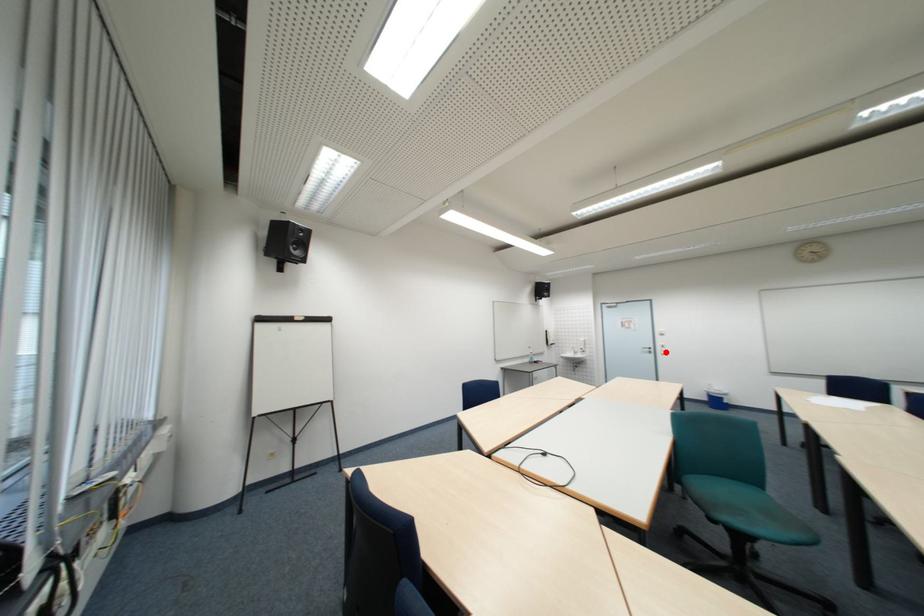
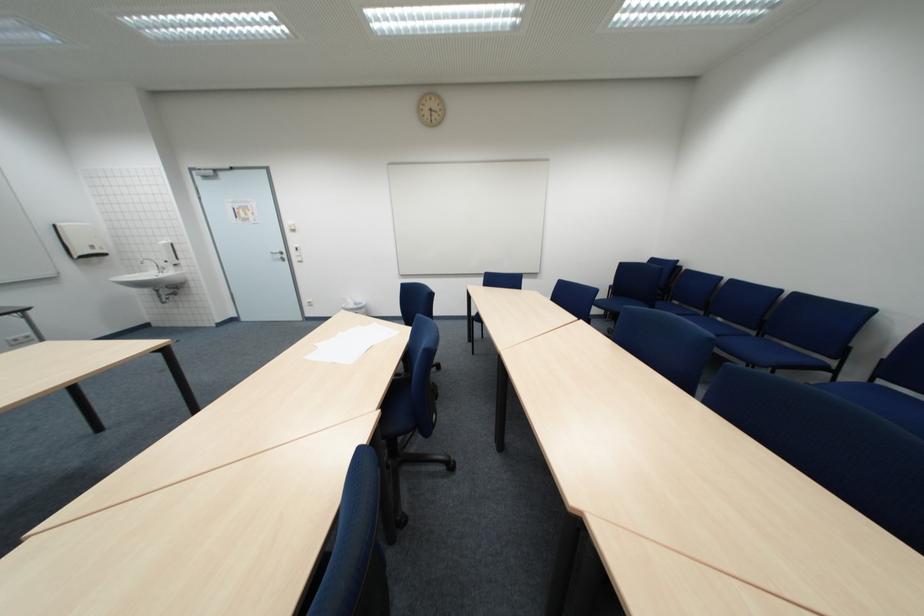
Where in the second image is the point corresponding to the highlighted location from the first image?

(299, 257)